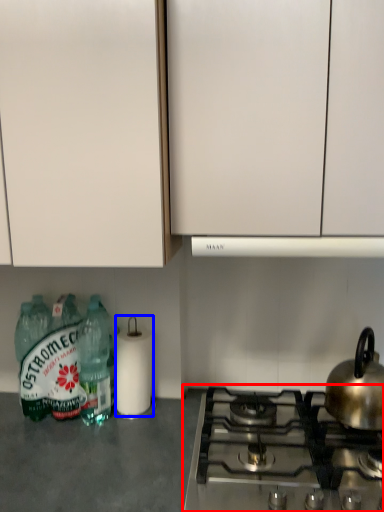
Question: Among these objects, which one is farthest to the camera, gas stove (highlighted by a red box) or paper towel (highlighted by a blue box)?

Choices:
 (A) gas stove
 (B) paper towel

Answer: (B)